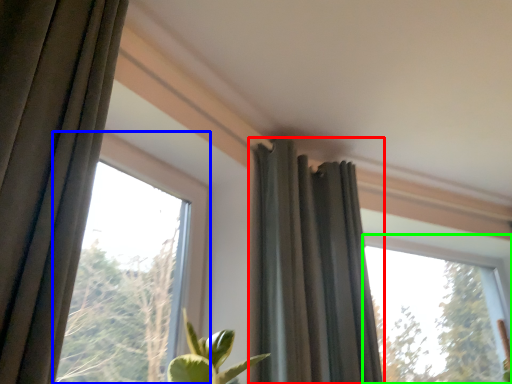
Question: Considering the real-world distances, which object is farthest from curtain (highlighted by a red box)? window (highlighted by a blue box) or window (highlighted by a green box)?

Choices:
 (A) window
 (B) window

Answer: (B)